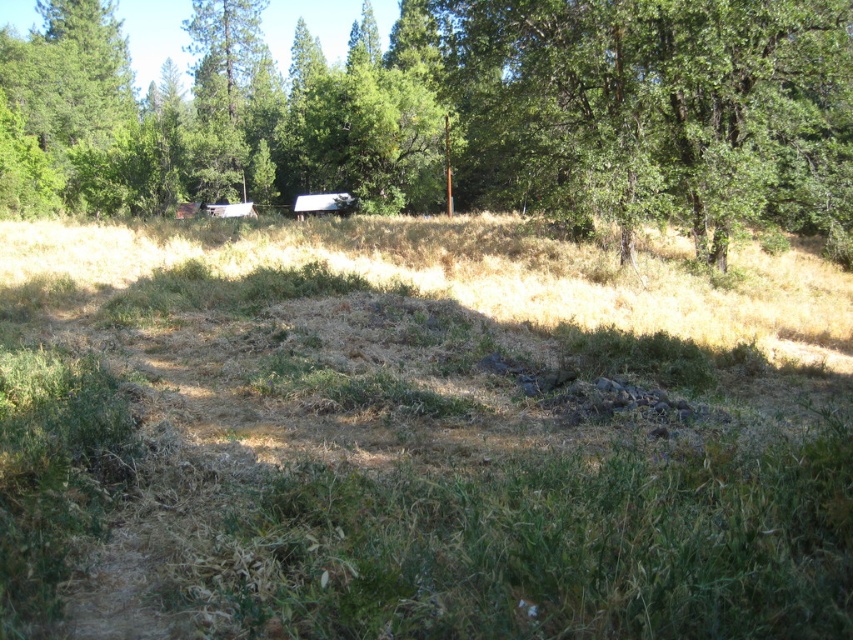
Question: Which point appears farthest from the camera in this image?

Choices:
 (A) (143, 156)
 (B) (503, 289)

Answer: (A)

Question: Is green grass at center further to the viewer compared to green leafy tree at upper center?

Choices:
 (A) no
 (B) yes

Answer: (A)

Question: Does green grass at center lie in front of green leafy tree at upper center?

Choices:
 (A) yes
 (B) no

Answer: (A)

Question: Where is green grass at center located in relation to green leafy tree at upper center in the image?

Choices:
 (A) above
 (B) below

Answer: (B)